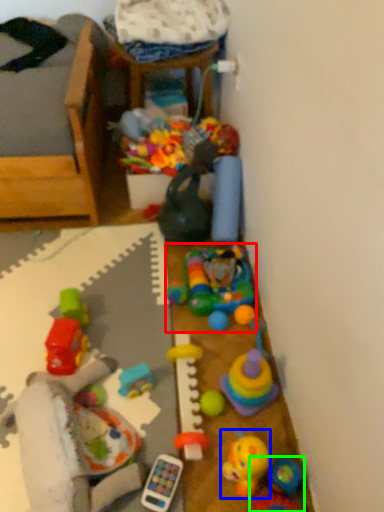
Question: Estimate the real-world distances between objects in this image. Which object is closer to toy (highlighted by a red box), toy (highlighted by a blue box) or toy (highlighted by a green box)?

Choices:
 (A) toy
 (B) toy

Answer: (A)